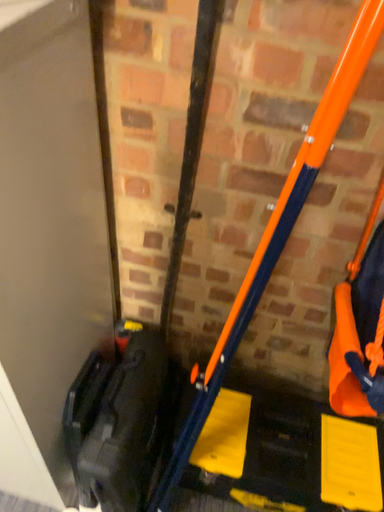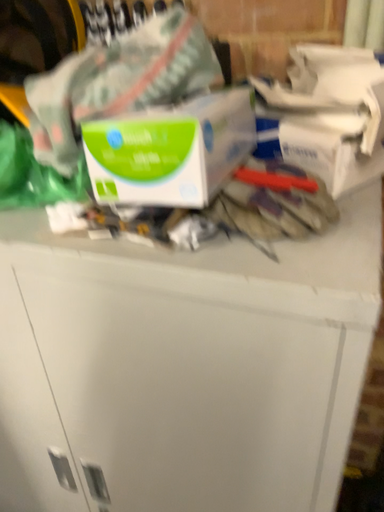
Question: Which way did the camera rotate in the video?

Choices:
 (A) rotated right
 (B) rotated left

Answer: (B)